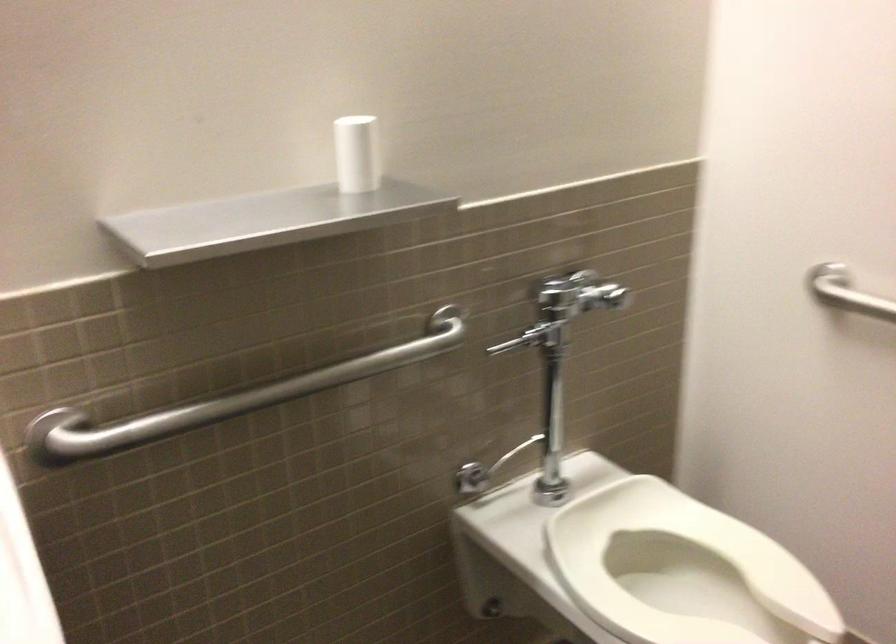
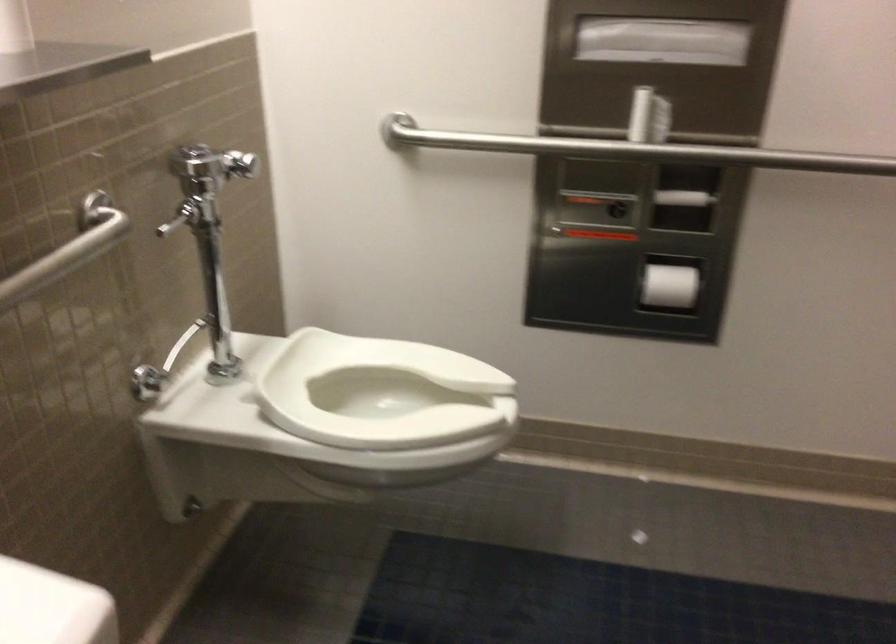
Locate, in the second image, the point that corresponds to [544,310] in the first image.

(203, 180)